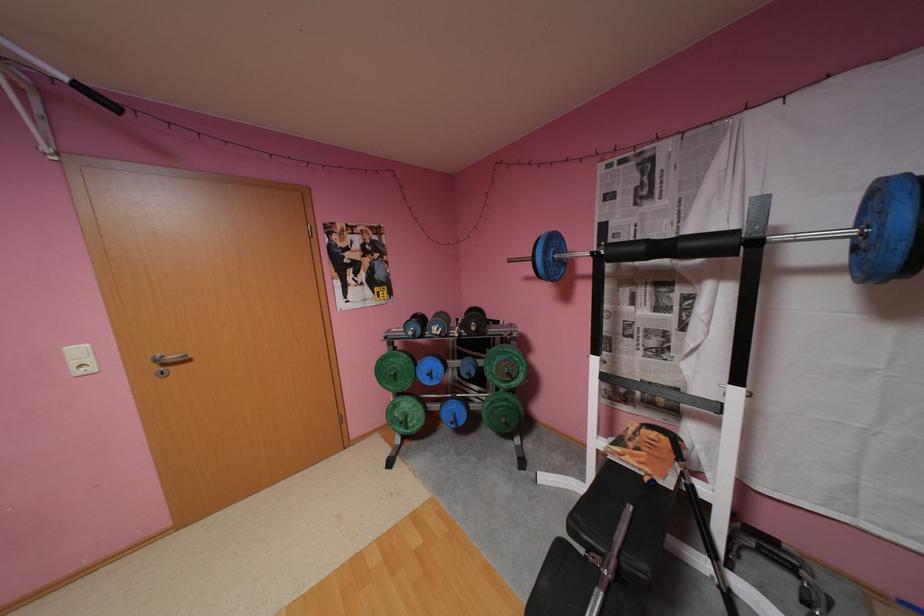
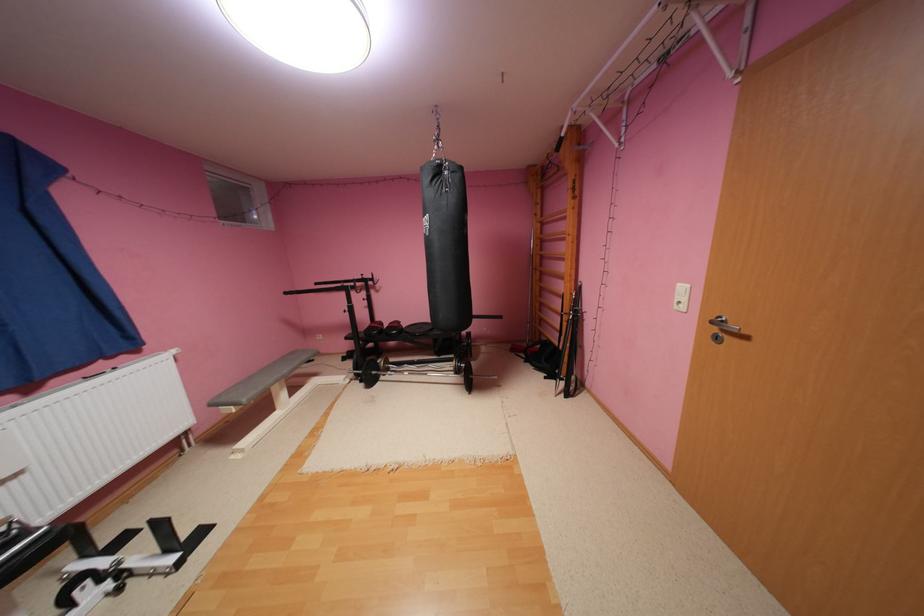
The point at (174,365) is marked in the first image. Where is the corresponding point in the second image?

(733, 330)